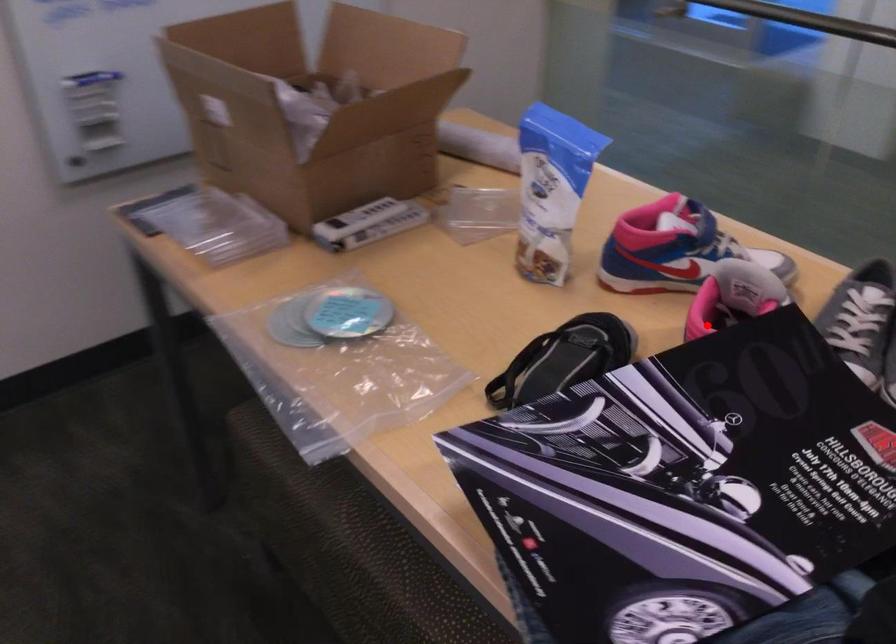
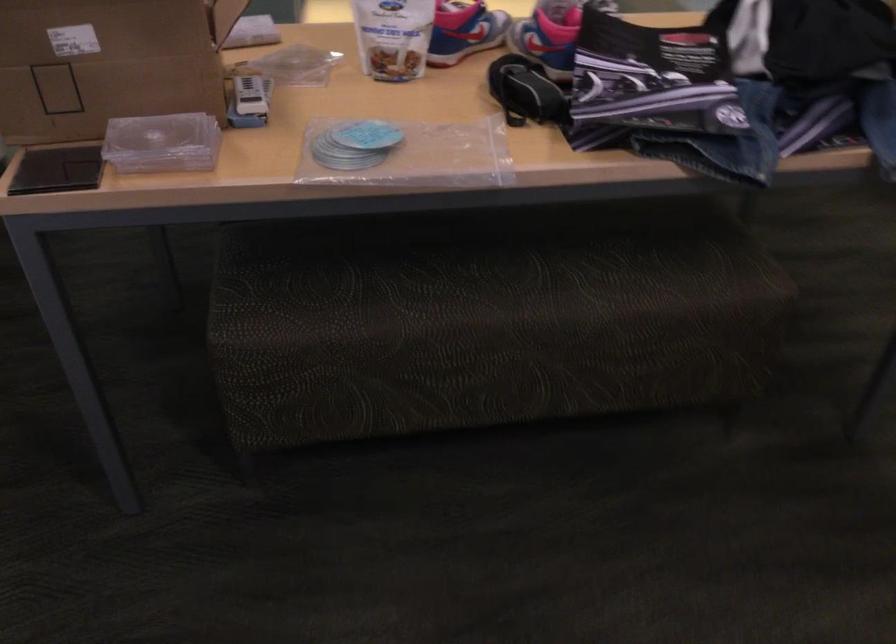
Question: A red point is marked in image1. In image2, is the corresponding 3D point closer to the camera or farther? Reply with the corresponding letter.

Choices:
 (A) The corresponding 3D point is closer.
 (B) The corresponding 3D point is farther.

Answer: (B)